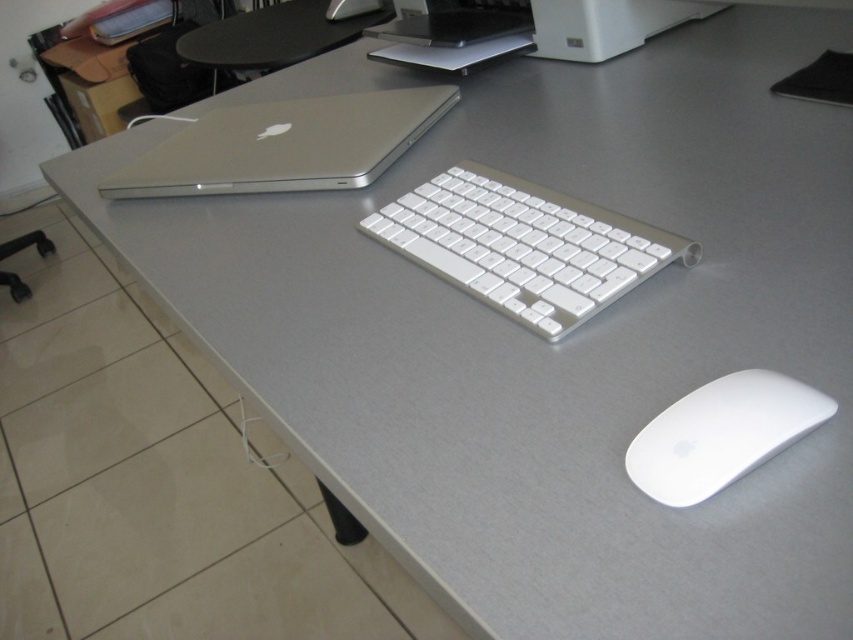
Where is `white plastic keyboard at center`? The image size is (853, 640). white plastic keyboard at center is located at coordinates [524, 244].

Does white plastic keyboard at center come behind white matte mouse at lower right?

Yes, white plastic keyboard at center is behind white matte mouse at lower right.

Between point (537, 211) and point (654, 426), which one is positioned in front?

Positioned in front is point (654, 426).

At what (x,y) coordinates should I click in order to perform the action: click on white plastic keyboard at center. Please return your answer as a coordinate pair (x, y). The image size is (853, 640). Looking at the image, I should click on (524, 244).

Does silver metallic laptop at upper left have a smaller size compared to white matte mouse at lower right?

No, silver metallic laptop at upper left is not smaller than white matte mouse at lower right.

From the picture: Which of these two, silver metallic laptop at upper left or white matte mouse at lower right, stands taller?

silver metallic laptop at upper left is taller.

Locate an element on the screen. This screenshot has width=853, height=640. silver metallic laptop at upper left is located at coordinates (285, 145).

The image size is (853, 640). What are the coordinates of `silver metallic laptop at upper left` in the screenshot? It's located at (285, 145).

Does white plastic keyboard at center have a lesser height compared to silver metallic laptop at upper left?

No.

Find the location of `white plastic keyboard at center`. white plastic keyboard at center is located at coordinates (524, 244).

You are a GUI agent. You are given a task and a screenshot of the screen. Output one action in this format:
    pyautogui.click(x=<x>, y=<y>)
    Task: Click on the white plastic keyboard at center
    
    Given the screenshot: What is the action you would take?
    pyautogui.click(x=524, y=244)